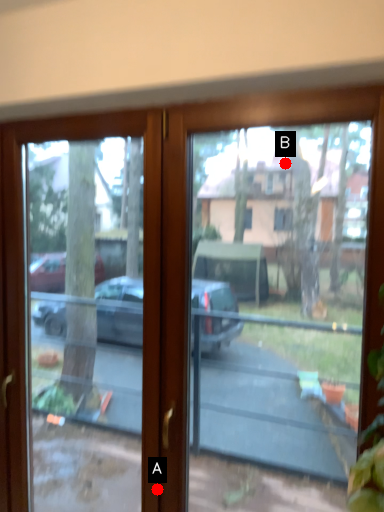
Question: Two points are circled on the image, labeled by A and B beside each circle. Among these points, which one is nearest to the camera?

Choices:
 (A) A is closer
 (B) B is closer

Answer: (A)